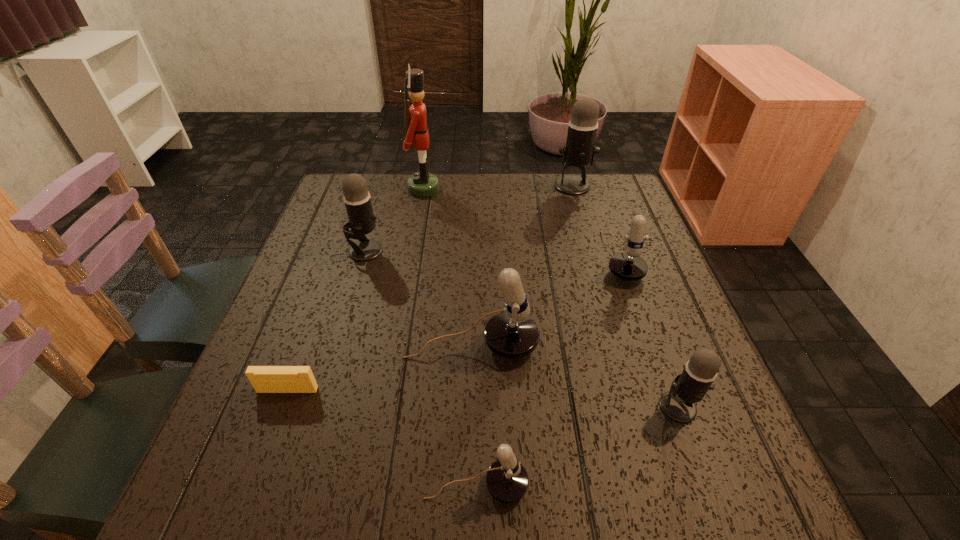
Where is `vacant space located 0.140m on the left of the farthest white microphone`? vacant space located 0.140m on the left of the farthest white microphone is located at coordinates (545, 258).

The image size is (960, 540). What are the coordinates of `vacant space situated 0.170m on the back of the nearest gray microphone` in the screenshot? It's located at (647, 322).

This screenshot has height=540, width=960. I want to click on vacant space situated on the back of the nearest object, so click(x=477, y=311).

What are the coordinates of `free space located 0.090m at the front of the beige videotape with spools` in the screenshot? It's located at (269, 441).

Identify the location of nutcracker present at the far edge. The height and width of the screenshot is (540, 960). (421, 184).

At what (x,y) coordinates should I click in order to perform the action: click on microphone present at the far edge. Please return your answer as a coordinate pair (x, y). The height and width of the screenshot is (540, 960). Looking at the image, I should click on (579, 151).

The image size is (960, 540). Identify the location of object located at the near edge. (507, 481).

The image size is (960, 540). Find the location of `microphone at the left edge`. microphone at the left edge is located at coordinates (357, 200).

Find the location of `videotape situated at the left edge`. videotape situated at the left edge is located at coordinates (265, 379).

At what (x,y) coordinates should I click in order to perform the action: click on object positioned at the far right corner. Please return your answer as a coordinate pair (x, y). This screenshot has width=960, height=540. Looking at the image, I should click on (579, 151).